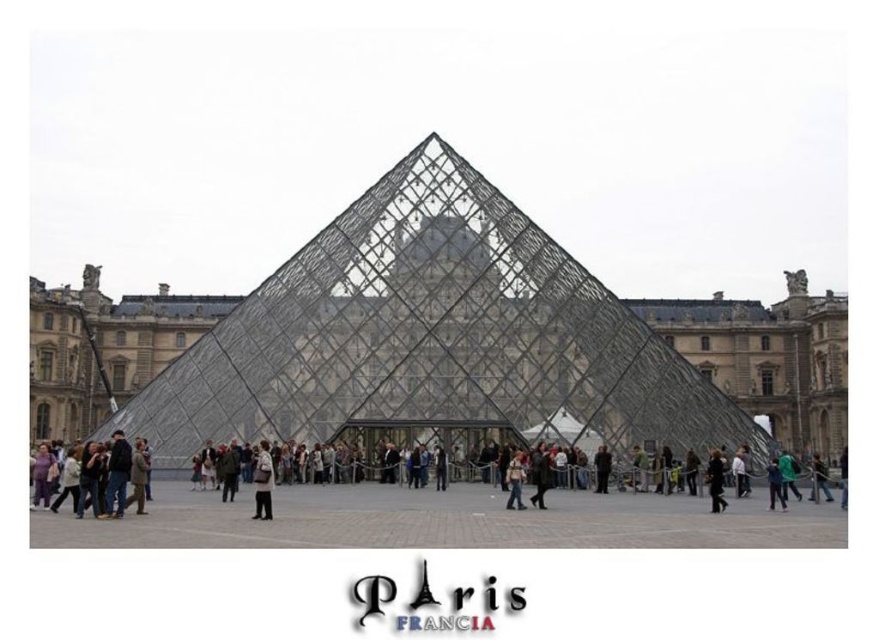
You are standing at the entrance of the Louvre Pyramid and see two people wearing jackets. One is wearing a dark gray fabric jacket at lower right and the other a black fabric jacket at center. Which jacket is closer to you?

The dark gray fabric jacket at lower right is closer to the viewer than the black fabric jacket at center.

You are a photographer standing at the base of the Louvre Pyramid. You notice two people wearing jackets in the scene. Which person wearing the dark gray fabric jacket at lower right or the black fabric jacket at center is taller?

The dark gray fabric jacket at lower right is taller than the black fabric jacket at center.

You are standing in the plaza in front of the Louvre Pyramid and notice two points marked on the pyramid. The first point is at coordinates point (721, 484) and the second is at point (608, 460). Which of these two points is closer to you?

Point (721, 484) is closer to the viewer than point (608, 460).